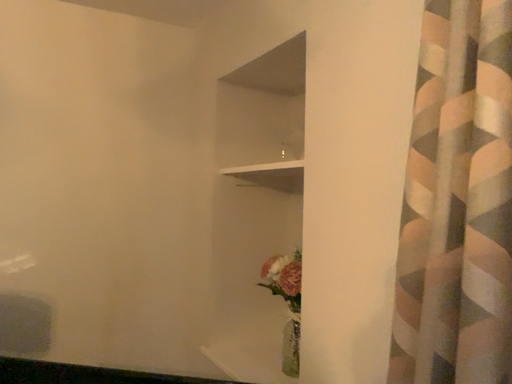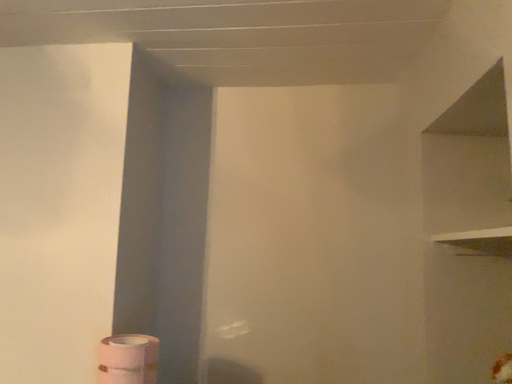
Question: Which way did the camera rotate in the video?

Choices:
 (A) rotated downward
 (B) rotated upward

Answer: (B)